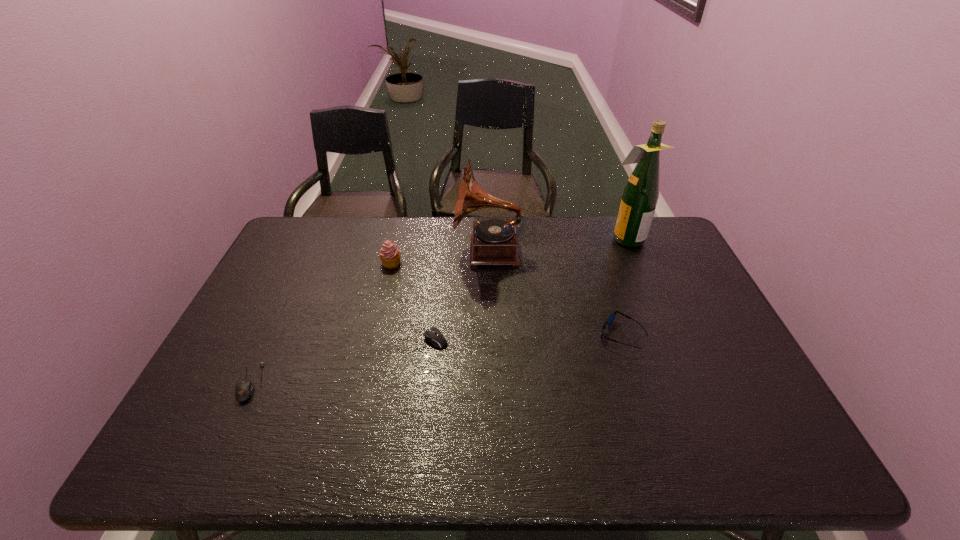
You are a GUI agent. You are given a task and a screenshot of the screen. Output one action in this format:
    pyautogui.click(x=<x>, y=<y>)
    Task: Click on the vacant region between the fourth tallest object and the rightmost object
    This screenshot has height=540, width=960.
    Given the screenshot: What is the action you would take?
    pyautogui.click(x=624, y=286)

Identify the location of vacant area that lies between the tallest object and the sunglasses. This screenshot has height=540, width=960. (624, 286).

Find the location of a particular element. unoccupied position between the right mouse and the liquor is located at coordinates (524, 289).

Where is `vacant region between the farther mouse and the liquor`? This screenshot has width=960, height=540. vacant region between the farther mouse and the liquor is located at coordinates (524, 289).

Identify which object is the third closest to the nearest object. Please provide its 2D coordinates. Your answer should be formatted as a tuple, i.e. [(x, y)], where the tuple contains the x and y coordinates of a point satisfying the conditions above.

[(494, 241)]

Identify the location of the second closest object to the tallest object. (610, 319).

Locate an element on the screen. The image size is (960, 540). vacant space that satisfies the following two spatial constraints: 1. on the horn of the phonograph_record; 2. on the front side of the farther mouse is located at coordinates (491, 341).

Where is `free location that satisfies the following two spatial constraints: 1. on the back side of the left mouse; 2. on the right side of the fifth object from right to left`? The height and width of the screenshot is (540, 960). free location that satisfies the following two spatial constraints: 1. on the back side of the left mouse; 2. on the right side of the fifth object from right to left is located at coordinates (307, 263).